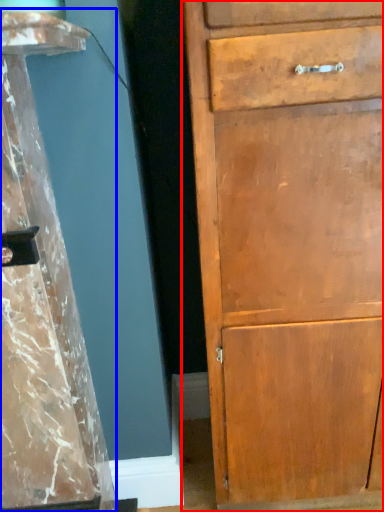
Question: Which object is further to the camera taking this photo, chest of drawers (highlighted by a red box) or pillar (highlighted by a blue box)?

Choices:
 (A) chest of drawers
 (B) pillar

Answer: (A)